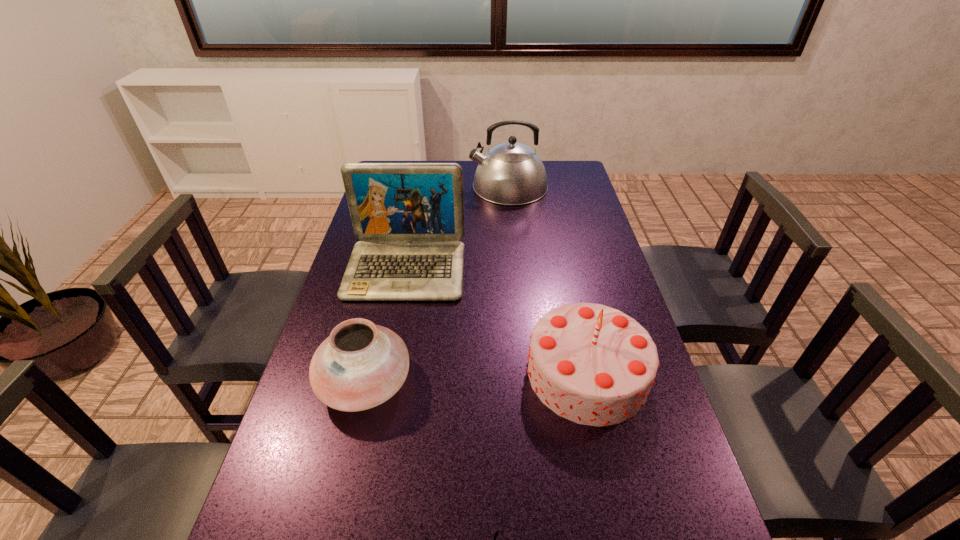
The image size is (960, 540). Find the location of `laptop computer`. laptop computer is located at coordinates (409, 216).

The height and width of the screenshot is (540, 960). I want to click on the farthest object, so click(511, 173).

Locate an element on the screen. This screenshot has width=960, height=540. birthday cake is located at coordinates (592, 364).

The width and height of the screenshot is (960, 540). In order to click on the fourth tallest object in this screenshot , I will do `click(361, 365)`.

Locate an element on the screen. vacant space positioned 0.100m on the screen of the laptop computer is located at coordinates (395, 328).

Where is `vacant space located from the spout of the kettle`? vacant space located from the spout of the kettle is located at coordinates pyautogui.click(x=405, y=186).

Find the location of a particular element. free space located 0.320m from the spout of the kettle is located at coordinates (391, 186).

Identify the location of free region located 0.070m from the spout of the kettle. This screenshot has width=960, height=540. (452, 186).

Identify the location of vacant space located on the left of the third tallest object. (366, 373).

Where is `free location located 0.130m on the front of the second shortest object`? The height and width of the screenshot is (540, 960). free location located 0.130m on the front of the second shortest object is located at coordinates (342, 483).